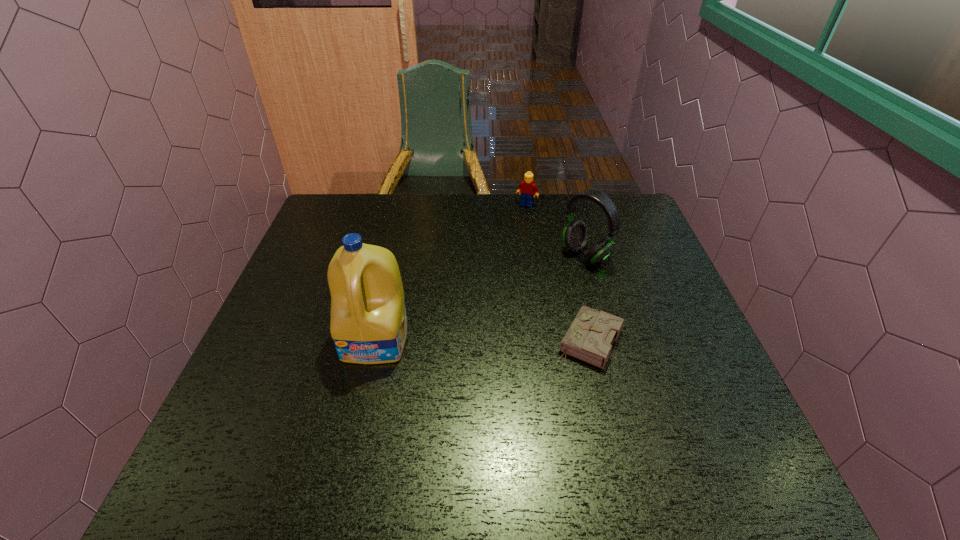
This screenshot has width=960, height=540. I want to click on free spot on the desktop that is between the detergent and the diary and is positioned on the front-facing side of the third tallest object, so click(x=459, y=340).

The image size is (960, 540). I want to click on vacant space on the desktop that is between the detergent and the diary and is positioned on the ear cups of the third shortest object, so click(462, 340).